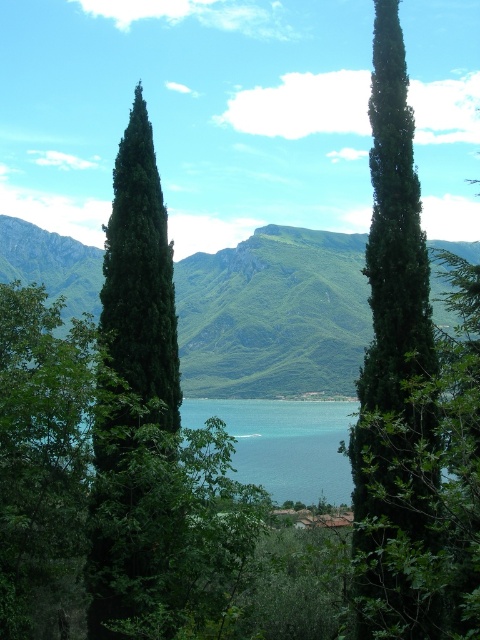
You are a hiker planning to reach the green leafy mountain at center. You see the point marked at coordinates [274,314]. Is this point the location of the mountain?

Yes, the green leafy mountain at center is represented by point [274,314], so this point marks the mountain.

You are an environmental scientist assessing the health of the trees in this landscape. Given that the green glossy cypress at center and the green matte tree at center are both present, which tree might indicate better health based on their appearance?

The green glossy cypress at center has a larger size compared to the green matte tree at center, suggesting it may be healthier as larger size can indicate better health in trees.